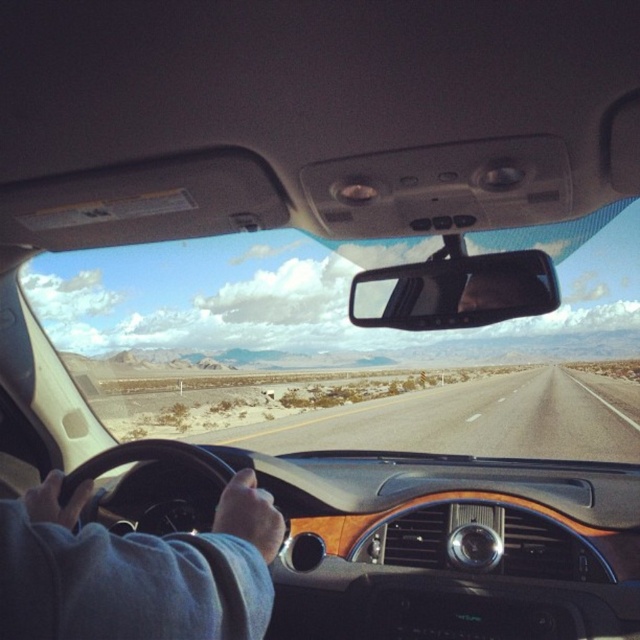
You are driving in the desert and need to check both the road ahead and your rearview mirror. Which object, the transparent glass windshield at center or the black plastic view mirror at center, is positioned lower relative to the other?

The transparent glass windshield at center is positioned lower than the black plastic view mirror at center.

You are driving through a desert and need to check your rearview mirror. Which object is closer to the center of the car, the transparent glass windshield at center or the black plastic view mirror at center?

The black plastic view mirror at center is closer to the center of the car because the transparent glass windshield at center is to the right of it.